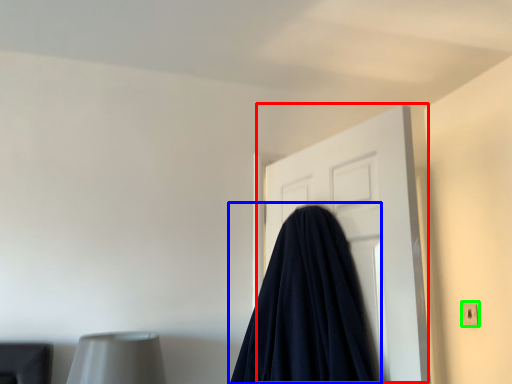
Question: Which is nearer to the door (highlighted by a red box)? blanket (highlighted by a blue box) or electric outlet (highlighted by a green box).

Choices:
 (A) blanket
 (B) electric outlet

Answer: (A)